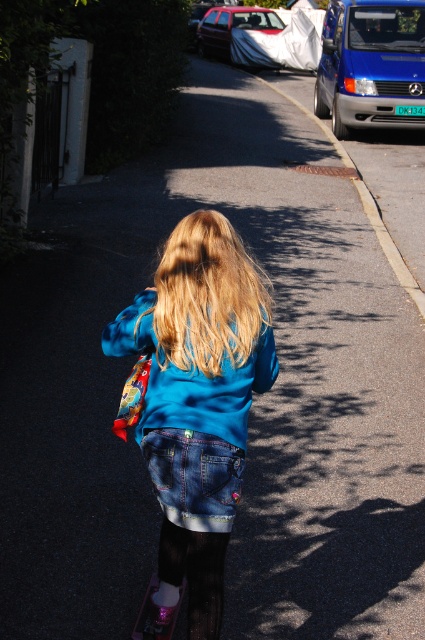
The young girl is wearing a bright blue long sleeved shirt and denim shorts. She has blonde silky hair at center and is riding a pink glittery skateboard at lower center. Which object is bigger?

The blonde silky hair at center is larger in size compared to the pink glittery skateboard at lower center.

You are a photographer trying to capture a shot of the blonde silky hair at center and the white matte car at upper center. From your current position, which object is positioned more to the right side of the frame?

The blonde silky hair at center is positioned more to the right of the frame compared to the white matte car at upper center.